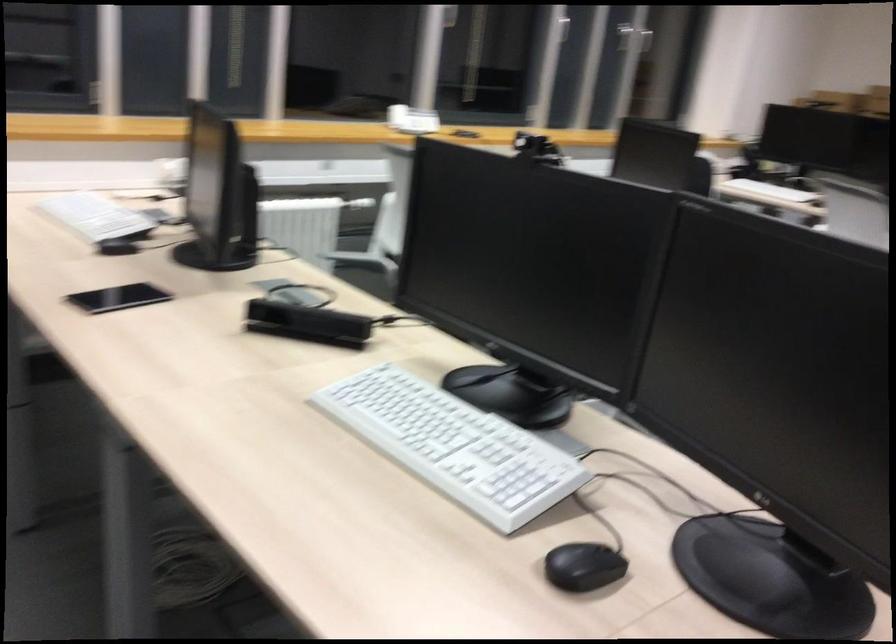
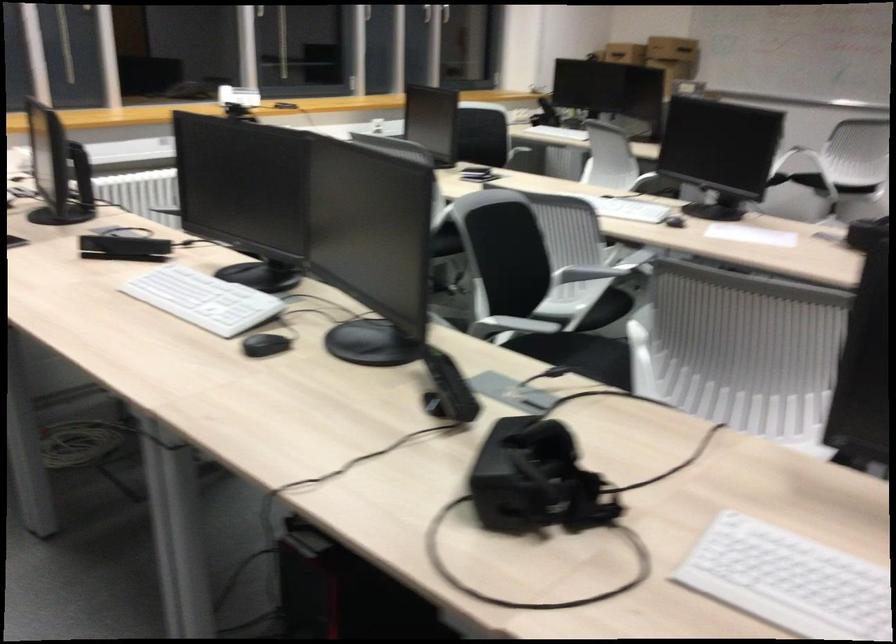
The point at (401,109) is marked in the first image. Where is the corresponding point in the second image?

(238, 96)